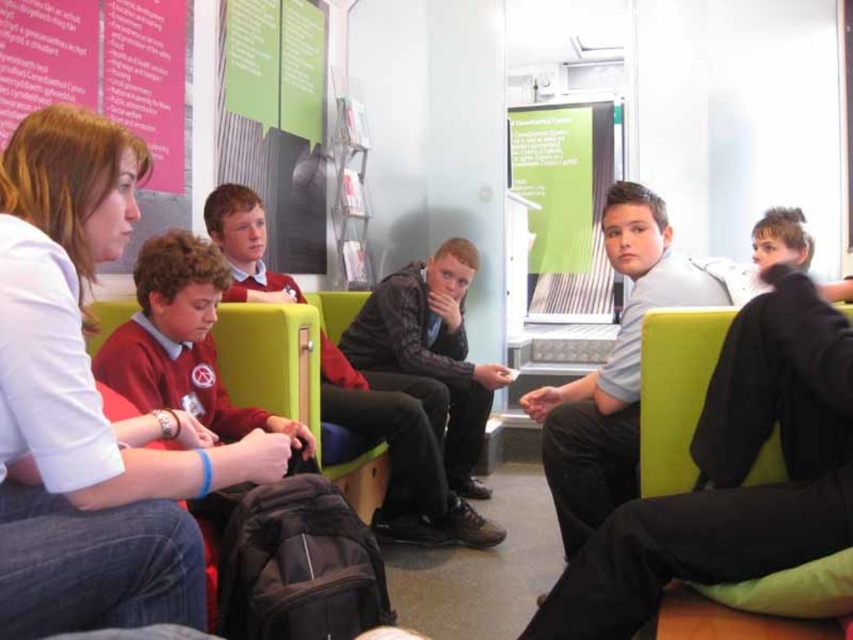
Question: Estimate the real-world distances between objects in this image. Which object is closer to the light gray shirt at center?

Choices:
 (A) dark gray jacket at center
 (B) red sweater at left

Answer: (A)

Question: Can you confirm if red sweater at left is positioned to the left of dark gray jacket at center?

Choices:
 (A) no
 (B) yes

Answer: (B)

Question: Is red sweater at left bigger than dark gray jacket at center?

Choices:
 (A) no
 (B) yes

Answer: (A)

Question: Among these points, which one is nearest to the camera?

Choices:
 (A) (404, 272)
 (B) (206, 440)

Answer: (B)

Question: Among these objects, which one is nearest to the camera?

Choices:
 (A) dark gray jacket at center
 (B) red sweater at left

Answer: (B)

Question: Is red sweater at left above light gray shirt at center?

Choices:
 (A) no
 (B) yes

Answer: (B)